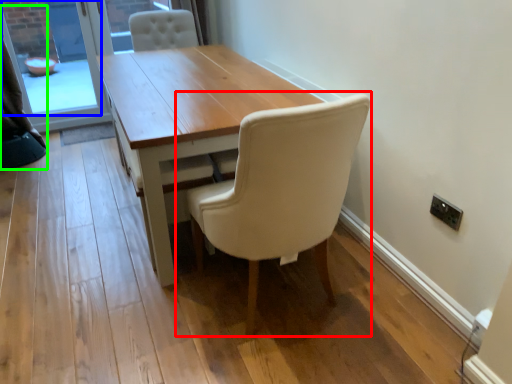
Question: Estimate the real-world distances between objects in this image. Which object is closer to chair (highlighted by a red box), window screen (highlighted by a blue box) or curtain (highlighted by a green box)?

Choices:
 (A) window screen
 (B) curtain

Answer: (B)